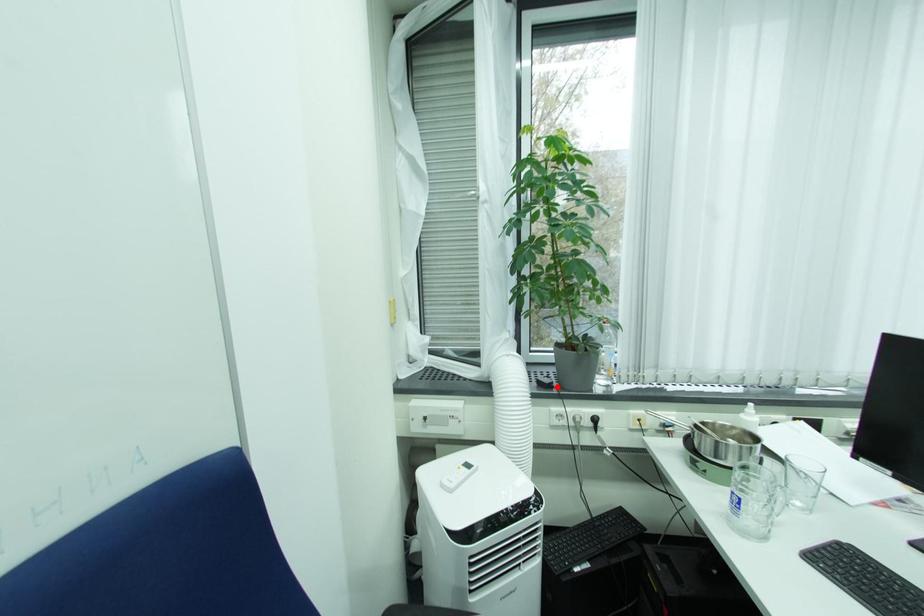
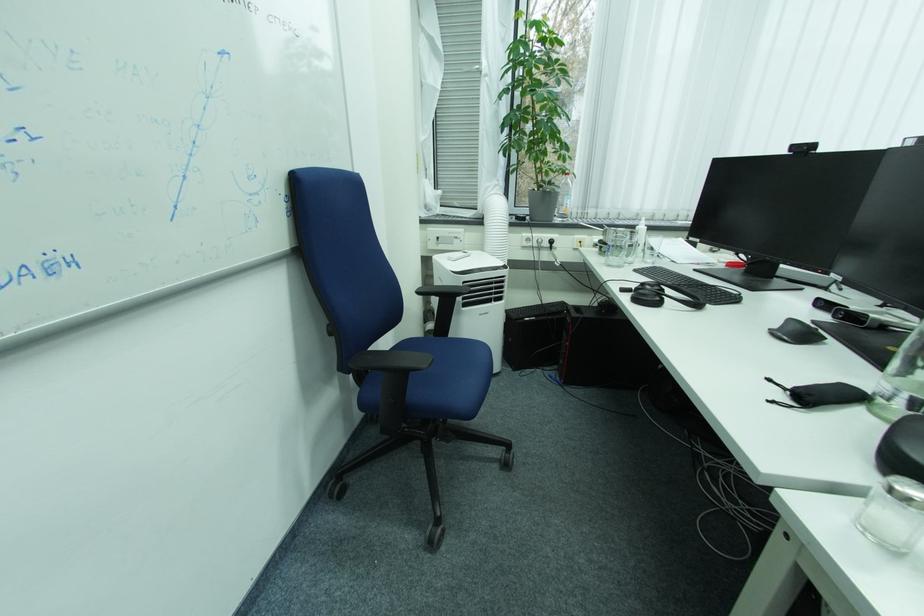
Question: I am providing you with two images of the same scene from different viewpoints. Given a red point in image1, look at the same physical point in image2. Is it:

Choices:
 (A) Closer to the viewpoint
 (B) Farther from the viewpoint

Answer: (A)